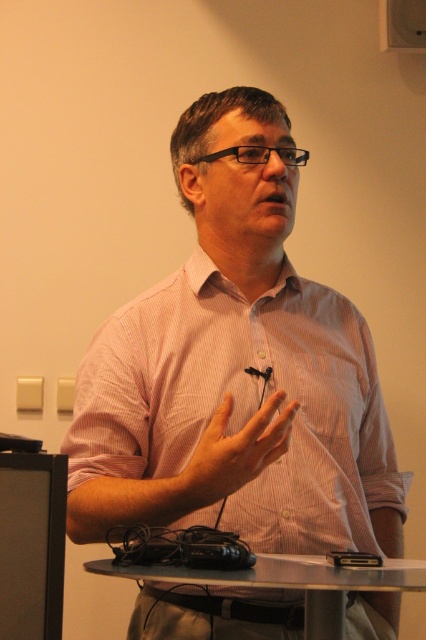
Question: Observing the image, what is the correct spatial positioning of pink striped shirt at center in reference to black glossy monitor at lower left?

Choices:
 (A) below
 (B) above

Answer: (B)

Question: Which of the following is the farthest from the observer?

Choices:
 (A) (245, 433)
 (B) (201, 108)

Answer: (B)

Question: Which point appears farthest from the camera in this image?

Choices:
 (A) (333, 602)
 (B) (63, 476)

Answer: (A)

Question: Considering the relative positions of black glossy monitor at lower left and pale skin/hair at center in the image provided, where is black glossy monitor at lower left located with respect to pale skin/hair at center?

Choices:
 (A) below
 (B) above

Answer: (A)

Question: Which point appears farthest from the camera in this image?

Choices:
 (A) (279, 394)
 (B) (328, 625)
 (C) (311, 326)
 (D) (3, 522)

Answer: (C)

Question: Is pink striped shirt at center below pale skin/hair at center?

Choices:
 (A) yes
 (B) no

Answer: (B)